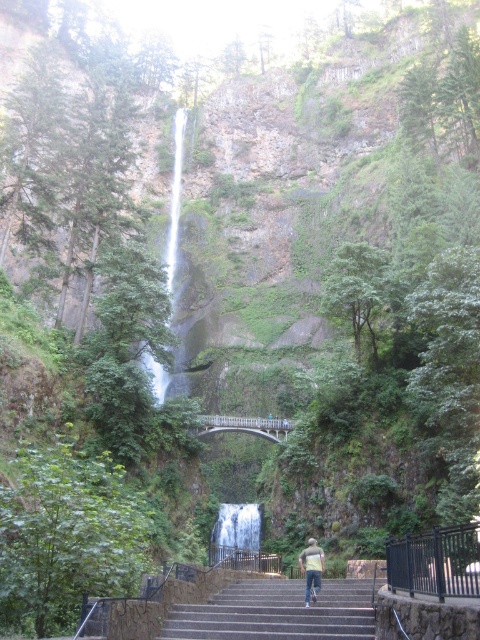
You are planning to climb the stairs in the scene and want to know if the white smooth waterfall at center is taller than the light blue jeans at center. Based on the scene description, can you determine which one is taller?

The white smooth waterfall at center has a lesser height compared to light blue jeans at center, so the light blue jeans at center are taller.

You are planning to take a photo of the white smooth waterfall at center and the light blue jeans at center. Which object should you focus on first if you want to capture both in one frame without moving the camera?

The white smooth waterfall at center is larger in size than the light blue jeans at center, so you should focus on the waterfall first to ensure it fills the frame appropriately before adjusting for the smaller jeans.

You are a hiker standing at the bottom of the stone stairs leading up to the waterfall. You see the gray concrete stairs at center and the light blue jeans at center. Which object is higher up the cliff?

The gray concrete stairs at center are located above the light blue jeans at center, so the stairs are higher up the cliff.